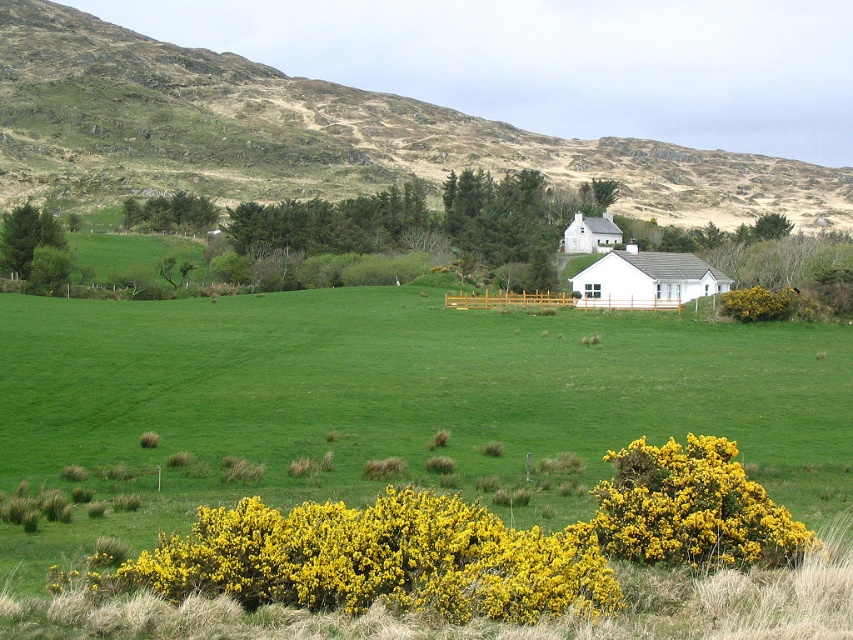
Does yellow fluffy bush at lower right have a smaller size compared to green leafy bush at left?

Yes, yellow fluffy bush at lower right is smaller than green leafy bush at left.

Is yellow fluffy bush at lower right wider than green leafy bush at left?

No, yellow fluffy bush at lower right is not wider than green leafy bush at left.

Where is `yellow fluffy bush at lower right`? The height and width of the screenshot is (640, 853). yellow fluffy bush at lower right is located at coordinates point(691,508).

At what (x,y) coordinates should I click in order to perform the action: click on yellow fluffy bush at lower right. Please return your answer as a coordinate pair (x, y). Looking at the image, I should click on (691, 508).

Who is taller, white smooth house at center or green leafy bush at left?

green leafy bush at left

Between point (651, 268) and point (10, 266), which one is positioned in front?

Point (651, 268) is more forward.

Describe the element at coordinates (645, 280) in the screenshot. I see `white smooth house at center` at that location.

At what (x,y) coordinates should I click in order to perform the action: click on white smooth house at center. Please return your answer as a coordinate pair (x, y). The width and height of the screenshot is (853, 640). Looking at the image, I should click on (645, 280).

Image resolution: width=853 pixels, height=640 pixels. In order to click on green grassy hillside at upper center in this screenshot , I will do `click(317, 134)`.

Is green grassy hillside at upper center positioned at the back of white smooth house at center-right?

Yes.

Between point (451, 132) and point (599, 250), which one is positioned behind?

Point (451, 132)

The height and width of the screenshot is (640, 853). I want to click on green grassy hillside at upper center, so click(x=317, y=134).